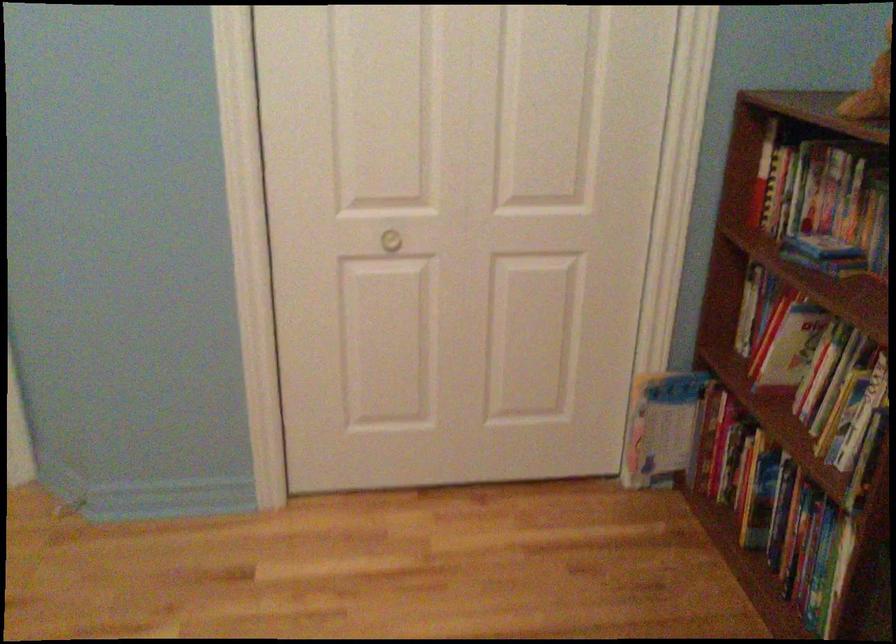
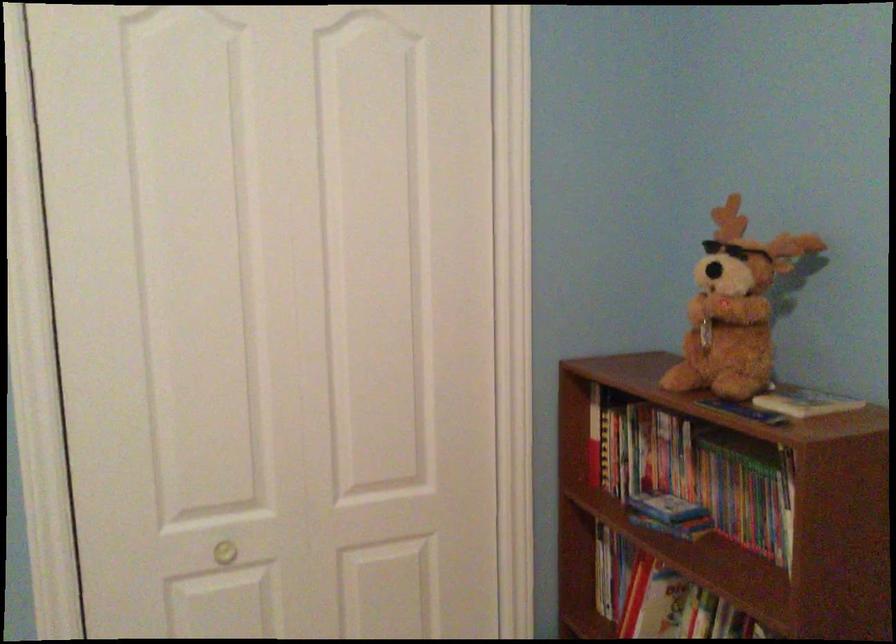
Question: The images are taken continuously from a first-person perspective. In which direction is your viewpoint rotating?

Choices:
 (A) Left
 (B) Right
 (C) Up
 (D) Down

Answer: (B)